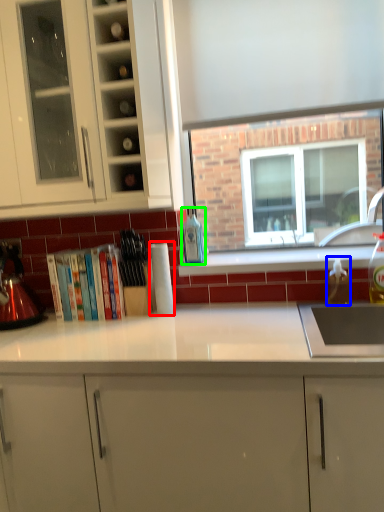
Question: Which is nearer to the paper towel (highlighted by a red box)? bottle (highlighted by a blue box) or bottle (highlighted by a green box).

Choices:
 (A) bottle
 (B) bottle

Answer: (B)